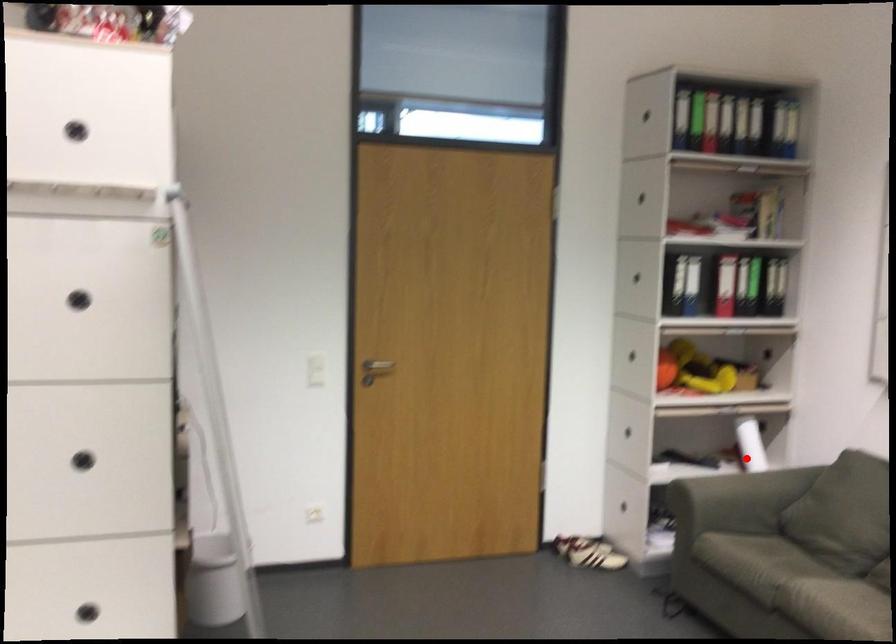
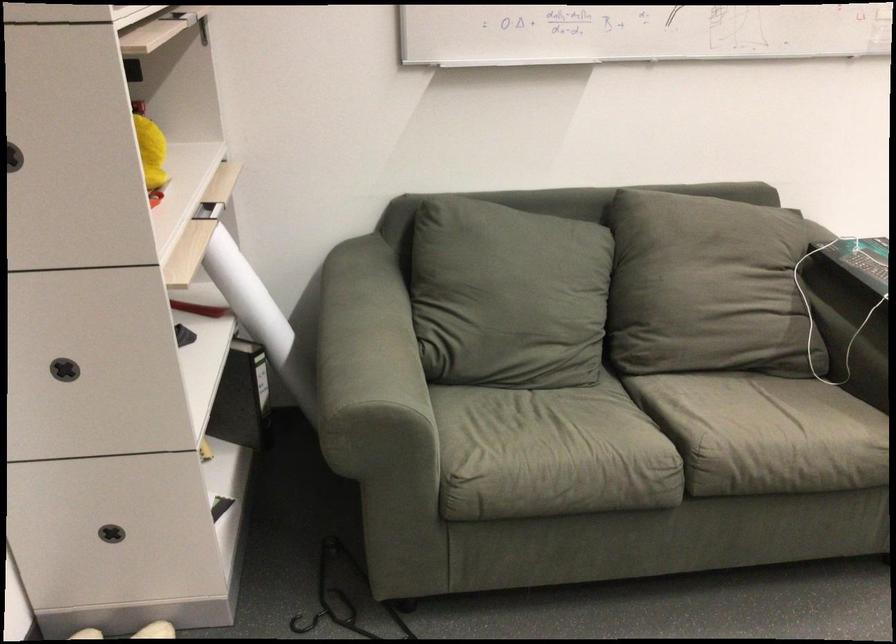
Question: I am providing you with two images of the same scene from different viewpoints. In image1, a red point is highlighted. Considering the same 3D point in image2, which of the following is correct?

Choices:
 (A) It is closer
 (B) It is farther

Answer: (A)